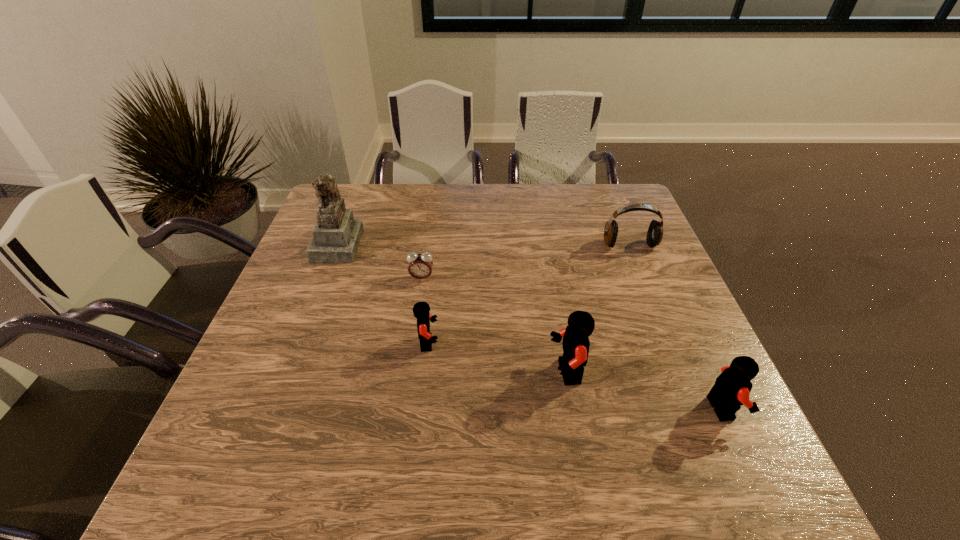
The image size is (960, 540). I want to click on free space at the far edge, so click(532, 190).

Locate an element on the screen. Image resolution: width=960 pixels, height=540 pixels. vacant area at the near edge is located at coordinates (310, 416).

The image size is (960, 540). What are the coordinates of `vacant space at the left edge of the desktop` in the screenshot? It's located at 309,358.

Identify the location of free space at the right edge of the desktop. (680, 345).

Where is `free space at the far left corner of the desktop`? free space at the far left corner of the desktop is located at coordinates (372, 191).

Image resolution: width=960 pixels, height=540 pixels. What are the coordinates of `vacant space that is in between the rightmost Lego and the second Lego from left to right` in the screenshot? It's located at (644, 390).

You are a GUI agent. You are given a task and a screenshot of the screen. Output one action in this format:
    pyautogui.click(x=<x>, y=<y>)
    Task: Click on the empty space that is in between the second Lego from right to left and the rightmost Lego
    This screenshot has height=540, width=960.
    Given the screenshot: What is the action you would take?
    pyautogui.click(x=644, y=390)

The height and width of the screenshot is (540, 960). Identify the location of free space between the shortest Lego and the leftmost object. (383, 293).

The width and height of the screenshot is (960, 540). In order to click on free space that is in between the rightmost Lego and the headset in this screenshot , I will do `click(676, 326)`.

Find the location of a particular element. This screenshot has width=960, height=540. vacant space in between the leftmost Lego and the second Lego from right to left is located at coordinates tap(497, 358).